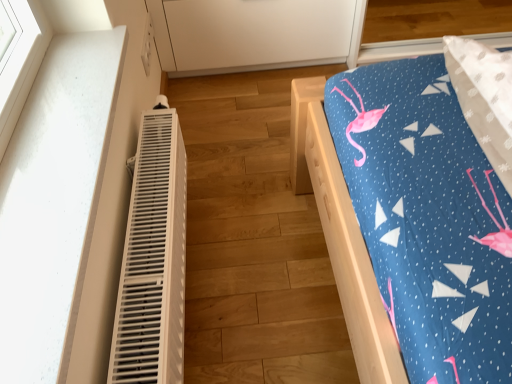
Question: Considering the relative sizes of white matte cabinet at upper center and white plastic heater at left in the image provided, is white matte cabinet at upper center thinner than white plastic heater at left?

Choices:
 (A) no
 (B) yes

Answer: (A)

Question: Is white matte cabinet at upper center oriented away from white plastic heater at left?

Choices:
 (A) yes
 (B) no

Answer: (B)

Question: Can you confirm if white matte cabinet at upper center is wider than white plastic heater at left?

Choices:
 (A) yes
 (B) no

Answer: (A)

Question: Would you say white matte cabinet at upper center is outside white plastic heater at left?

Choices:
 (A) no
 (B) yes

Answer: (B)

Question: From a real-world perspective, is white matte cabinet at upper center located higher than white plastic heater at left?

Choices:
 (A) no
 (B) yes

Answer: (A)

Question: Looking at the image, does wooden bed at right seem bigger or smaller compared to white plastic heater at left?

Choices:
 (A) big
 (B) small

Answer: (A)

Question: From their relative heights in the image, would you say wooden bed at right is taller or shorter than white plastic heater at left?

Choices:
 (A) short
 (B) tall

Answer: (A)

Question: Based on their positions, is wooden bed at right located to the left or right of white plastic heater at left?

Choices:
 (A) right
 (B) left

Answer: (A)

Question: Is wooden bed at right wider or thinner than white plastic heater at left?

Choices:
 (A) wide
 (B) thin

Answer: (A)

Question: Considering the positions of point (140, 152) and point (163, 62), is point (140, 152) closer or farther from the camera than point (163, 62)?

Choices:
 (A) farther
 (B) closer

Answer: (B)

Question: Is white plastic heater at left bigger or smaller than white matte cabinet at upper center?

Choices:
 (A) big
 (B) small

Answer: (B)

Question: In the image, is white plastic heater at left positioned in front of or behind white matte cabinet at upper center?

Choices:
 (A) front
 (B) behind

Answer: (A)

Question: From the image's perspective, is white plastic heater at left located above or below white matte cabinet at upper center?

Choices:
 (A) above
 (B) below

Answer: (B)

Question: Considering their positions, is white plastic heater at left located in front of or behind wooden bed at right?

Choices:
 (A) front
 (B) behind

Answer: (A)

Question: Is white plastic heater at left wider or thinner than wooden bed at right?

Choices:
 (A) thin
 (B) wide

Answer: (A)